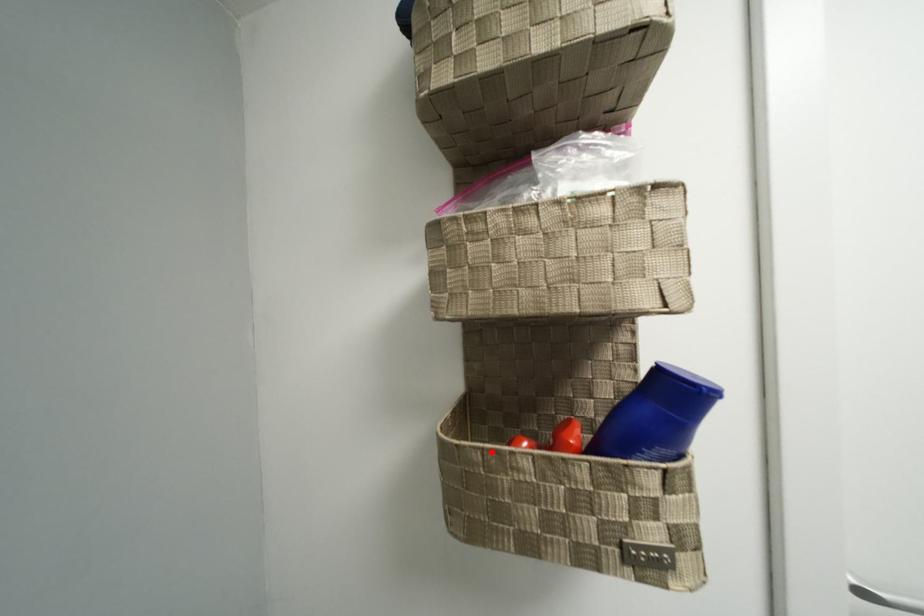
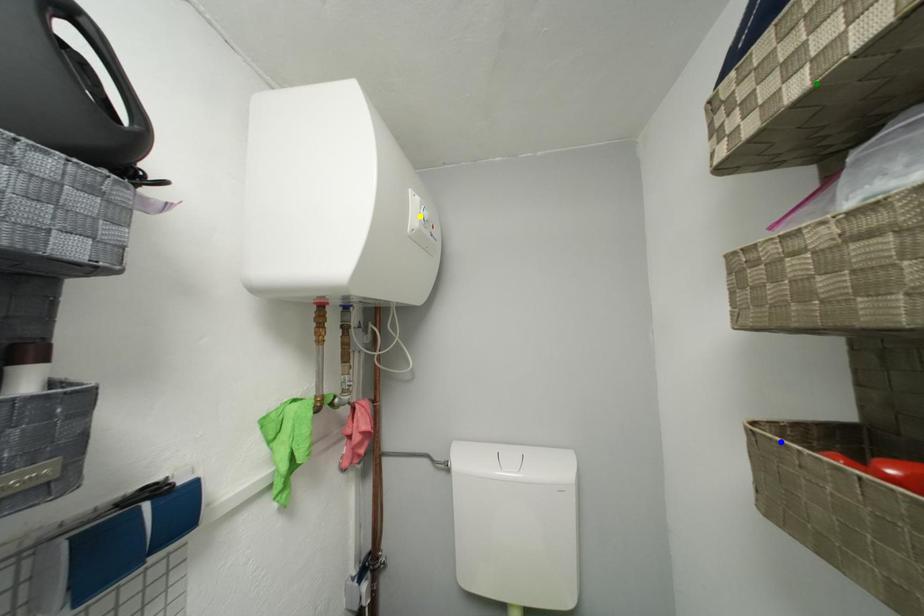
Question: I am providing you with two images of the same scene from different viewpoints. A red point is marked on the first image. You are given multiple points on the second image. Which spot in image 2 lines up with the point in image 1?

Choices:
 (A) blue point
 (B) green point
 (C) yellow point

Answer: (A)